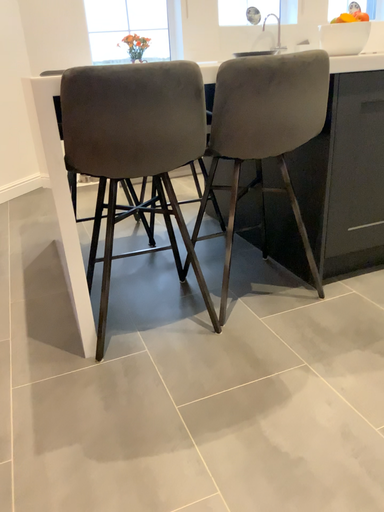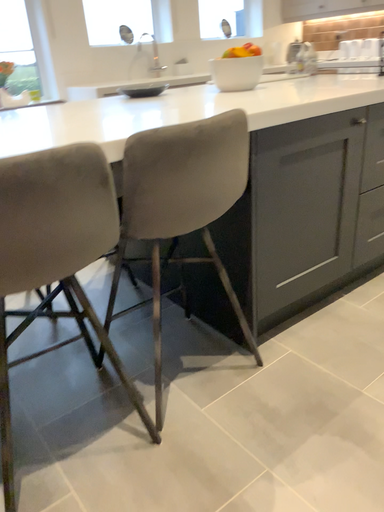
Question: Which way did the camera rotate in the video?

Choices:
 (A) rotated left
 (B) rotated right

Answer: (B)